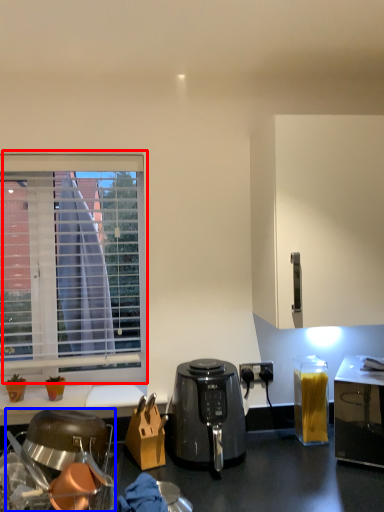
Question: Among these objects, which one is farthest to the camera, window (highlighted by a red box) or kitchen appliance (highlighted by a blue box)?

Choices:
 (A) window
 (B) kitchen appliance

Answer: (A)